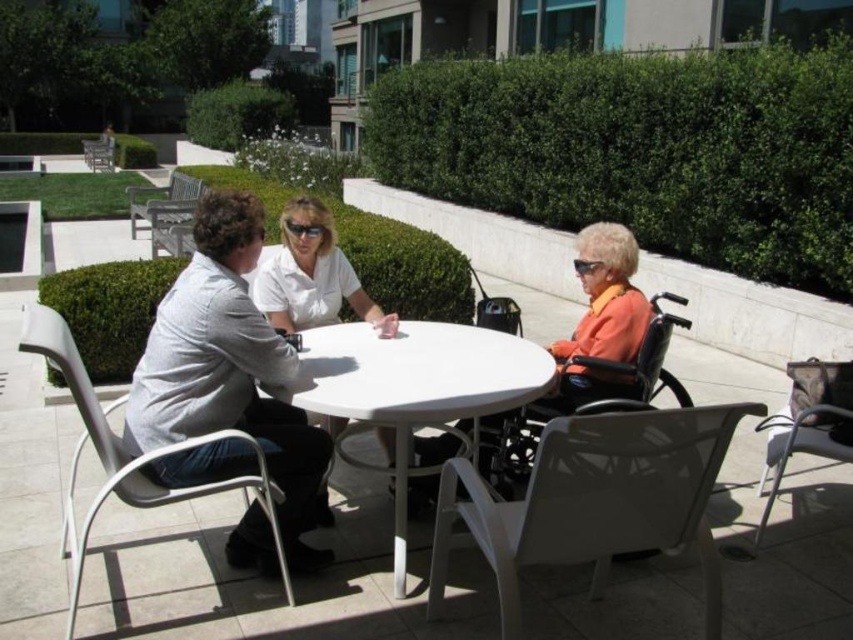
Is green leafy hedge at upper right bigger than white plastic chair at left?

No, green leafy hedge at upper right is not bigger than white plastic chair at left.

In the scene shown: Does green leafy hedge at upper right appear on the left side of white plastic chair at left?

In fact, green leafy hedge at upper right is to the right of white plastic chair at left.

Identify the location of green leafy hedge at upper right. (641, 148).

Is point (720, 404) behind point (128, 192)?

No, (720, 404) is in front of (128, 192).

Is white plastic chair at lower right bigger than wooden bench at upper left?

Incorrect, white plastic chair at lower right is not larger than wooden bench at upper left.

The height and width of the screenshot is (640, 853). Describe the element at coordinates (595, 500) in the screenshot. I see `white plastic chair at lower right` at that location.

Find the location of a particular element. white plastic chair at lower right is located at coordinates (595, 500).

Can you confirm if green leafy hedge at upper right is shorter than wooden bench at upper left?

Indeed, green leafy hedge at upper right has a lesser height compared to wooden bench at upper left.

Between green leafy hedge at upper right and wooden bench at upper left, which one has more height?

Standing taller between the two is wooden bench at upper left.

The width and height of the screenshot is (853, 640). Find the location of `green leafy hedge at upper right`. green leafy hedge at upper right is located at coordinates (641, 148).